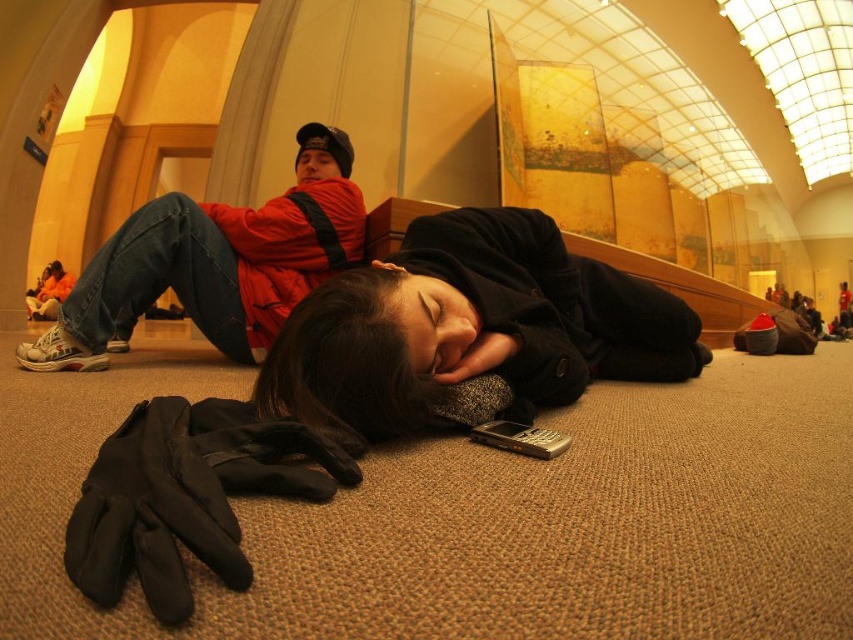
Question: Can you confirm if red fleece jacket at upper left is positioned to the left of black fuzzy head at center?

Choices:
 (A) no
 (B) yes

Answer: (B)

Question: Which is nearer to the silver metallic phone at lower center?

Choices:
 (A) matte black cap at upper center
 (B) red fleece jacket at upper left
 (C) black fuzzy head at center

Answer: (C)

Question: Which object is farther from the camera taking this photo?

Choices:
 (A) red fleece jacket at upper left
 (B) matte black cap at upper center
 (C) silver metallic phone at lower center

Answer: (B)

Question: Which of these objects is positioned farthest from the matte black cap at upper center?

Choices:
 (A) black woolen coat at center
 (B) silver metallic phone at lower center
 (C) black fuzzy head at center

Answer: (B)

Question: Is the position of silver metallic phone at lower center more distant than that of matte black cap at upper center?

Choices:
 (A) no
 (B) yes

Answer: (A)

Question: Is red fleece jacket at upper left wider than matte black cap at upper center?

Choices:
 (A) yes
 (B) no

Answer: (A)